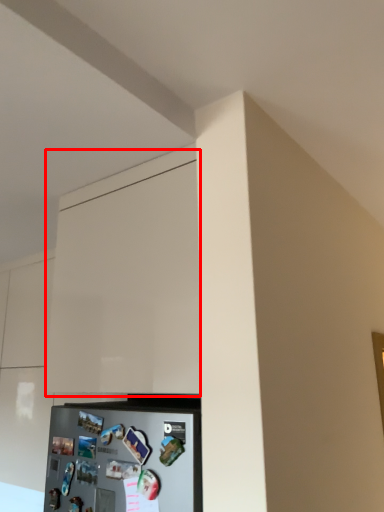
Question: From the image's perspective, what is the correct spatial positioning of cabinetry (annotated by the red box) in reference to appliance?

Choices:
 (A) below
 (B) above

Answer: (B)